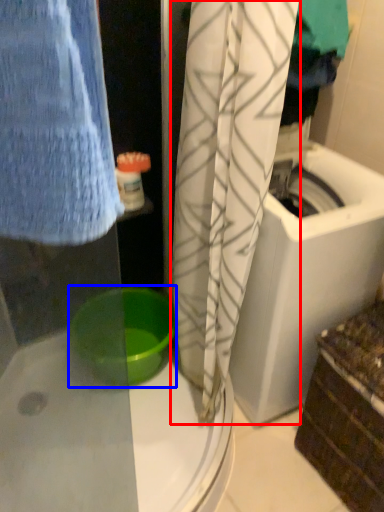
Question: Which object appears closest to the camera in this image, curtain (highlighted by a red box) or basin (highlighted by a blue box)?

Choices:
 (A) curtain
 (B) basin

Answer: (A)